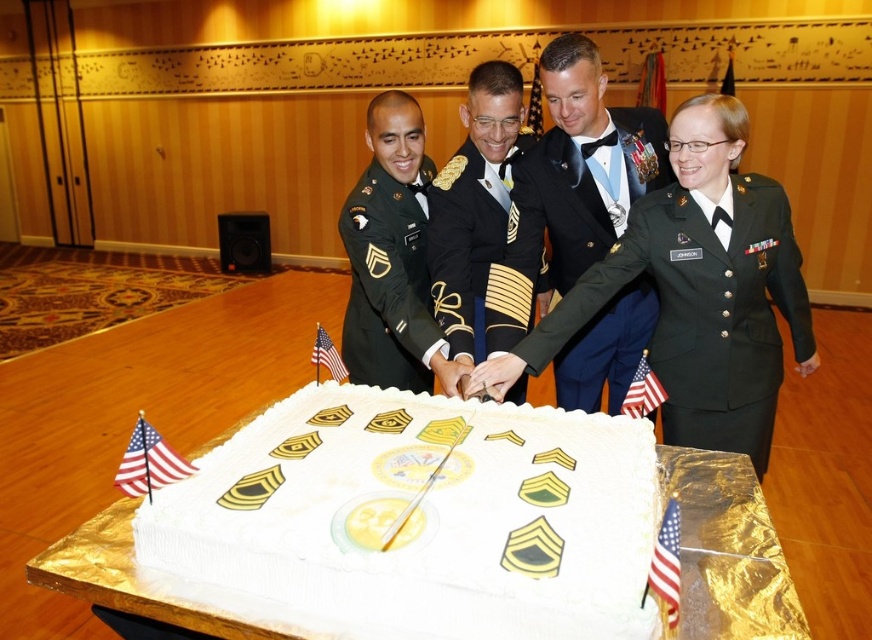
Who is positioned more to the right, white fabric flag at lower left or white fabric flag at lower center?

From the viewer's perspective, white fabric flag at lower center appears more on the right side.

Which is more to the left, white fabric flag at lower left or white fabric flag at lower center?

From the viewer's perspective, white fabric flag at lower left appears more on the left side.

Find the location of a particular element. This screenshot has width=872, height=640. white fabric flag at lower left is located at coordinates (148, 461).

Who is more distant from viewer, [557,385] or [130,477]?

The point [557,385] is more distant.

Can you confirm if green military uniform at center is thinner than white fabric flag at lower left?

Incorrect, green military uniform at center's width is not less than white fabric flag at lower left's.

Is point (545, 170) farther from camera compared to point (140, 468)?

Yes, it is behind point (140, 468).

I want to click on green military uniform at center, so click(x=569, y=211).

Is green fabric uniform at center shorter than american flag at center?

In fact, green fabric uniform at center may be taller than american flag at center.

Does point (758, 230) come in front of point (321, 349)?

That is False.

Which is behind, point (690, 385) or point (314, 349)?

The point (690, 385) is more distant.

This screenshot has width=872, height=640. Identify the location of green fabric uniform at center. (703, 310).